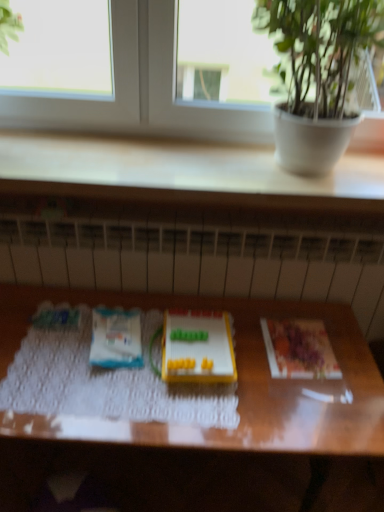
You are a GUI agent. You are given a task and a screenshot of the screen. Output one action in this format:
    pyautogui.click(x=<x>, y=<y>)
    Task: Click on the vacant space in between yellow plastic toy at center and printed paper at right, which appears as the first paperback book when viewed from the right
    This screenshot has width=384, height=512.
    Given the screenshot: What is the action you would take?
    pyautogui.click(x=255, y=353)